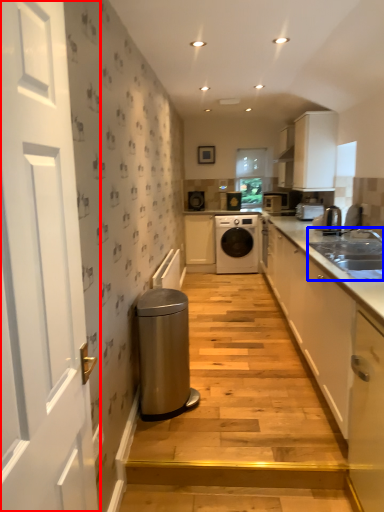
Question: Which object is closer to the camera taking this photo, door (highlighted by a red box) or sink (highlighted by a blue box)?

Choices:
 (A) door
 (B) sink

Answer: (A)